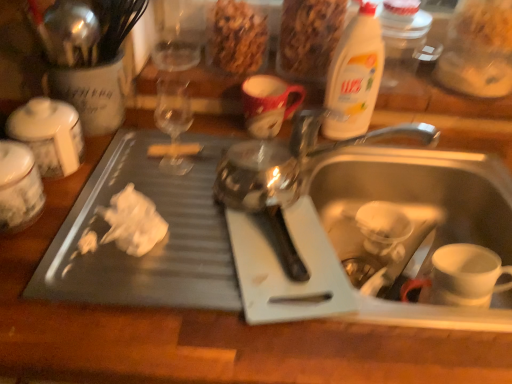
Question: Considering the positions of white plastic sink at lower right and matte ceramic mug at upper center in the image, is white plastic sink at lower right bigger or smaller than matte ceramic mug at upper center?

Choices:
 (A) big
 (B) small

Answer: (A)

Question: Does point (343, 236) appear closer or farther from the camera than point (273, 87)?

Choices:
 (A) farther
 (B) closer

Answer: (A)

Question: Which object is positioned farthest from the crumbly brown granola at upper center, which is the first food from left to right?

Choices:
 (A) granular brown cereal at upper center, positioned as the first food in right-to-left order
 (B) white plastic sink at lower right
 (C) white plastic bottle at upper right
 (D) matte ceramic mug at upper center
 (E) white matte coffee cup at sink bottom

Answer: (E)

Question: Based on their relative distances, which object is farther from the white matte coffee cup at sink bottom?

Choices:
 (A) white plastic sink at lower right
 (B) white plastic bottle at upper right
 (C) crumbly brown granola at upper center, which is the first food from left to right
 (D) matte ceramic mug at upper center
 (E) granular brown cereal at upper center, positioned as the first food in right-to-left order

Answer: (C)